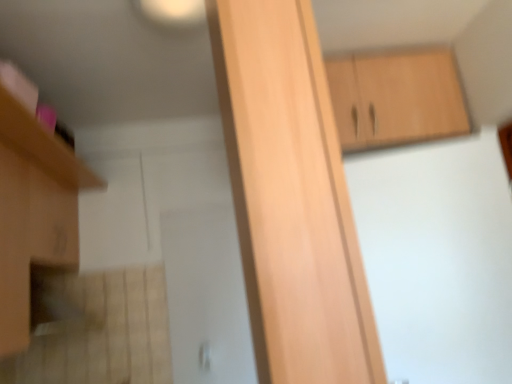
The image size is (512, 384). Find the location of `matte wood cabinet at left, acting as the 3th cabinetry starting from the right`. matte wood cabinet at left, acting as the 3th cabinetry starting from the right is located at coordinates (33, 202).

How different are the orientations of light wood cabinet at center, which is counted as the third cabinetry, starting from the back, and matte wood cabinet at left, marked as the second cabinetry in a back-to-front arrangement, in degrees?

The angular difference between light wood cabinet at center, which is counted as the third cabinetry, starting from the back, and matte wood cabinet at left, marked as the second cabinetry in a back-to-front arrangement, is 7.45 degrees.

Is light wood cabinet at center, arranged as the 2th cabinetry when viewed from the right, positioned behind matte wood cabinet at left, marked as the second cabinetry in a back-to-front arrangement?

No, light wood cabinet at center, arranged as the 2th cabinetry when viewed from the right, is in front of matte wood cabinet at left, marked as the second cabinetry in a back-to-front arrangement.

In the scene shown: From the image's perspective, is light wood cabinet at center, which is counted as the third cabinetry, starting from the back, located above or below matte wood cabinet at left, acting as the 3th cabinetry starting from the right?

Clearly, from the image's perspective, light wood cabinet at center, which is counted as the third cabinetry, starting from the back, is above matte wood cabinet at left, acting as the 3th cabinetry starting from the right.

Which of these two, light wood cabinet at center, which is the 2th cabinetry in left-to-right order, or matte wood cabinet at left, marked as the second cabinetry in a front-to-back arrangement, is smaller?

light wood cabinet at center, which is the 2th cabinetry in left-to-right order, is smaller.

From the image's perspective, is light brown wood cabinet at upper right, which ranks as the 3th cabinetry in left-to-right order, above or below matte wood cabinet at left, acting as the 3th cabinetry starting from the right?

From the image's perspective, light brown wood cabinet at upper right, which ranks as the 3th cabinetry in left-to-right order, appears above matte wood cabinet at left, acting as the 3th cabinetry starting from the right.

Does point (362, 78) come farther from viewer compared to point (77, 180)?

No, (362, 78) is in front of (77, 180).

Is light brown wood cabinet at upper right, which ranks as the 3th cabinetry in left-to-right order, oriented away from matte wood cabinet at left, marked as the second cabinetry in a front-to-back arrangement?

No.

Is light brown wood cabinet at upper right, placed as the first cabinetry when sorted from back to front, not inside matte wood cabinet at left, placed as the first cabinetry when sorted from left to right?

light brown wood cabinet at upper right, placed as the first cabinetry when sorted from back to front, is positioned outside matte wood cabinet at left, placed as the first cabinetry when sorted from left to right.

Does point (57, 226) lie in front of point (266, 256)?

No, (57, 226) is further to viewer.

From the image's perspective, is matte wood cabinet at left, marked as the second cabinetry in a back-to-front arrangement, on light wood cabinet at center, arranged as the 2th cabinetry when viewed from the right?

Actually, matte wood cabinet at left, marked as the second cabinetry in a back-to-front arrangement, appears below light wood cabinet at center, arranged as the 2th cabinetry when viewed from the right, in the image.

Is matte wood cabinet at left, marked as the second cabinetry in a back-to-front arrangement, far away from light wood cabinet at center, arranged as the 1th cabinetry when viewed from the front?

Yes, matte wood cabinet at left, marked as the second cabinetry in a back-to-front arrangement, and light wood cabinet at center, arranged as the 1th cabinetry when viewed from the front, are quite far apart.

From a real-world perspective, between matte wood cabinet at left, marked as the second cabinetry in a back-to-front arrangement, and light wood cabinet at center, arranged as the 2th cabinetry when viewed from the right, who is vertically higher?

In real-world perspective, matte wood cabinet at left, marked as the second cabinetry in a back-to-front arrangement, is above.

This screenshot has height=384, width=512. In the image, there is a light wood cabinet at center, which is the 2th cabinetry in left-to-right order. Find the location of `cabinetry above it (from the image's perspective)`. cabinetry above it (from the image's perspective) is located at coordinates (396, 98).

Do you think light wood cabinet at center, which is the 2th cabinetry in left-to-right order, is within light brown wood cabinet at upper right, the 3th cabinetry viewed from the front, or outside of it?

light wood cabinet at center, which is the 2th cabinetry in left-to-right order, is outside light brown wood cabinet at upper right, the 3th cabinetry viewed from the front.

From a real-world perspective, which object rests below the other?

light wood cabinet at center, arranged as the 1th cabinetry when viewed from the front.

From the image's perspective, is matte wood cabinet at left, acting as the 3th cabinetry starting from the right, on light brown wood cabinet at upper right, placed as the first cabinetry when sorted from back to front?

No, from the image's perspective, matte wood cabinet at left, acting as the 3th cabinetry starting from the right, is not above light brown wood cabinet at upper right, placed as the first cabinetry when sorted from back to front.

Is point (14, 347) more distant than point (392, 114)?

No, (14, 347) is closer to viewer.

From a real-world perspective, is matte wood cabinet at left, marked as the second cabinetry in a back-to-front arrangement, on top of light brown wood cabinet at upper right, placed as the first cabinetry when sorted from back to front?

No, from a real-world perspective, matte wood cabinet at left, marked as the second cabinetry in a back-to-front arrangement, is not on top of light brown wood cabinet at upper right, placed as the first cabinetry when sorted from back to front.

Is matte wood cabinet at left, marked as the second cabinetry in a front-to-back arrangement, completely or partially outside of light brown wood cabinet at upper right, which ranks as the 3th cabinetry in left-to-right order?

That's correct, matte wood cabinet at left, marked as the second cabinetry in a front-to-back arrangement, is outside of light brown wood cabinet at upper right, which ranks as the 3th cabinetry in left-to-right order.

Considering the relative sizes of light brown wood cabinet at upper right, the 3th cabinetry viewed from the front, and light wood cabinet at center, which is counted as the third cabinetry, starting from the back, in the image provided, is light brown wood cabinet at upper right, the 3th cabinetry viewed from the front, shorter than light wood cabinet at center, which is counted as the third cabinetry, starting from the back,?

Yes, light brown wood cabinet at upper right, the 3th cabinetry viewed from the front, is shorter than light wood cabinet at center, which is counted as the third cabinetry, starting from the back.

From the image's perspective, who appears lower, light brown wood cabinet at upper right, which ranks as the first cabinetry in right-to-left order, or light wood cabinet at center, which is the 2th cabinetry in left-to-right order?

light wood cabinet at center, which is the 2th cabinetry in left-to-right order, is shown below in the image.

From a real-world perspective, between light brown wood cabinet at upper right, which ranks as the first cabinetry in right-to-left order, and light wood cabinet at center, arranged as the 2th cabinetry when viewed from the right, who is vertically higher?

In real-world perspective, light brown wood cabinet at upper right, which ranks as the first cabinetry in right-to-left order, is above.

Is light brown wood cabinet at upper right, which ranks as the first cabinetry in right-to-left order, facing towards light wood cabinet at center, arranged as the 2th cabinetry when viewed from the right?

Yes, light brown wood cabinet at upper right, which ranks as the first cabinetry in right-to-left order, is aimed at light wood cabinet at center, arranged as the 2th cabinetry when viewed from the right.

At what (x,y) coordinates should I click in order to perform the action: click on cabinetry that appears in front of the matte wood cabinet at left, marked as the second cabinetry in a back-to-front arrangement. Please return your answer as a coordinate pair (x, y). Looking at the image, I should click on (291, 197).

Where is `cabinetry lying behind the matte wood cabinet at left, acting as the 3th cabinetry starting from the right`? The height and width of the screenshot is (384, 512). cabinetry lying behind the matte wood cabinet at left, acting as the 3th cabinetry starting from the right is located at coordinates (396, 98).

Estimate the real-world distances between objects in this image. Which object is further from light brown wood cabinet at upper right, which ranks as the first cabinetry in right-to-left order, matte wood cabinet at left, acting as the 3th cabinetry starting from the right, or light wood cabinet at center, which is the 2th cabinetry in left-to-right order?

matte wood cabinet at left, acting as the 3th cabinetry starting from the right.

Estimate the real-world distances between objects in this image. Which object is further from matte wood cabinet at left, marked as the second cabinetry in a front-to-back arrangement, light brown wood cabinet at upper right, placed as the first cabinetry when sorted from back to front, or light wood cabinet at center, arranged as the 2th cabinetry when viewed from the right?

light brown wood cabinet at upper right, placed as the first cabinetry when sorted from back to front, lies further to matte wood cabinet at left, marked as the second cabinetry in a front-to-back arrangement, than the other object.

Estimate the real-world distances between objects in this image. Which object is closer to matte wood cabinet at left, marked as the second cabinetry in a front-to-back arrangement, light wood cabinet at center, arranged as the 1th cabinetry when viewed from the front, or light brown wood cabinet at upper right, which ranks as the 3th cabinetry in left-to-right order?

light wood cabinet at center, arranged as the 1th cabinetry when viewed from the front, is positioned closer to the anchor matte wood cabinet at left, marked as the second cabinetry in a front-to-back arrangement.

Based on their spatial positions, is light brown wood cabinet at upper right, which ranks as the first cabinetry in right-to-left order, or matte wood cabinet at left, acting as the 3th cabinetry starting from the right, further from light wood cabinet at center, arranged as the 2th cabinetry when viewed from the right?

Based on the image, light brown wood cabinet at upper right, which ranks as the first cabinetry in right-to-left order, appears to be further to light wood cabinet at center, arranged as the 2th cabinetry when viewed from the right.

Considering their positions, is light wood cabinet at center, arranged as the 2th cabinetry when viewed from the right, positioned closer to light brown wood cabinet at upper right, which ranks as the 3th cabinetry in left-to-right order, than matte wood cabinet at left, marked as the second cabinetry in a back-to-front arrangement?

Based on the image, light wood cabinet at center, arranged as the 2th cabinetry when viewed from the right, appears to be nearer to light brown wood cabinet at upper right, which ranks as the 3th cabinetry in left-to-right order.

Looking at the image, which one is located closer to light wood cabinet at center, arranged as the 1th cabinetry when viewed from the front, matte wood cabinet at left, marked as the second cabinetry in a front-to-back arrangement, or light brown wood cabinet at upper right, placed as the first cabinetry when sorted from back to front?

matte wood cabinet at left, marked as the second cabinetry in a front-to-back arrangement, is positioned closer to the anchor light wood cabinet at center, arranged as the 1th cabinetry when viewed from the front.

This screenshot has height=384, width=512. Identify the location of cabinetry between matte wood cabinet at left, placed as the first cabinetry when sorted from left to right, and light brown wood cabinet at upper right, which ranks as the first cabinetry in right-to-left order, in the horizontal direction. (291, 197).